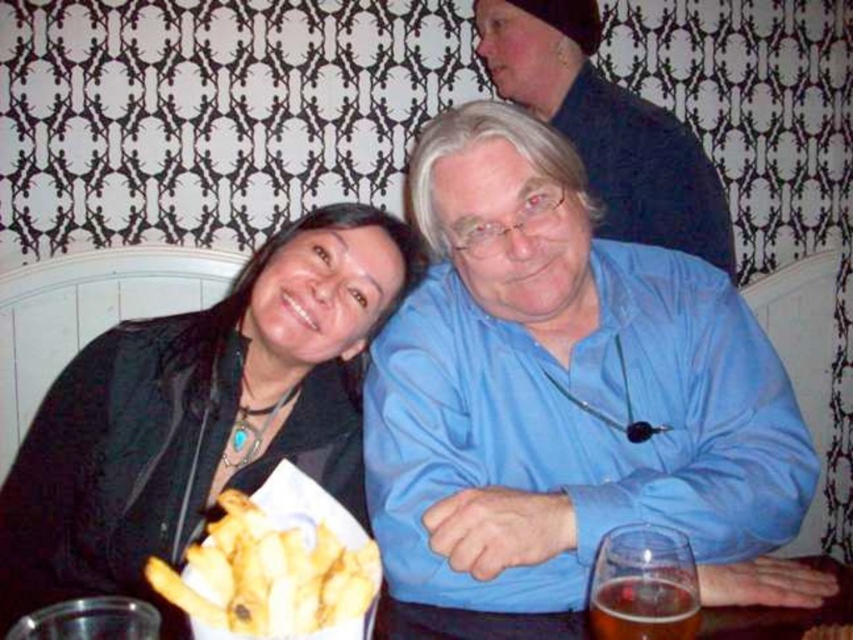
Locate an element on the screen. Image resolution: width=853 pixels, height=640 pixels. black leather jacket at upper left is located at coordinates (201, 412).

Does point (54, 404) lie behind point (280, 486)?

Yes.

Is point (68, 451) positioned after point (193, 621)?

Yes, point (68, 451) is farther from viewer.

This screenshot has height=640, width=853. In order to click on black leather jacket at upper left in this screenshot , I will do `click(201, 412)`.

Is blue satin shirt at center to the left of black leather jacket at upper left from the viewer's perspective?

No, blue satin shirt at center is not to the left of black leather jacket at upper left.

Who is more forward, [467,355] or [334,301]?

Point [334,301] is more forward.

The image size is (853, 640). In order to click on blue satin shirt at center in this screenshot , I will do `click(566, 403)`.

Find the location of a particular element. The height and width of the screenshot is (640, 853). blue satin shirt at center is located at coordinates (566, 403).

From the picture: Which of these two, black leather jacket at upper left or matte black jacket at upper center, stands shorter?

With less height is black leather jacket at upper left.

Does point (247, 305) lie in front of point (534, 60)?

Yes, point (247, 305) is in front of point (534, 60).

Is point (215, 346) less distant than point (582, 38)?

Yes, point (215, 346) is in front of point (582, 38).

The height and width of the screenshot is (640, 853). In order to click on black leather jacket at upper left in this screenshot , I will do `click(201, 412)`.